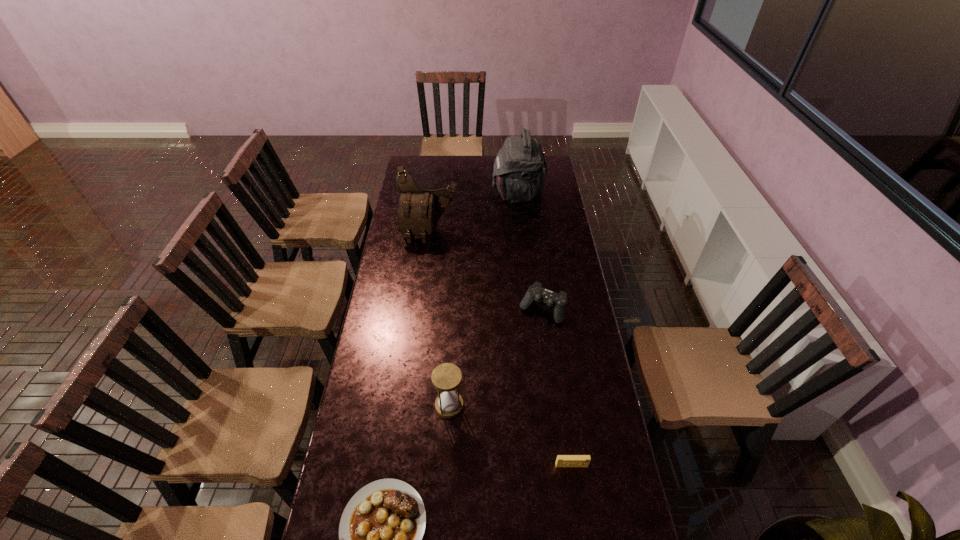
Find the location of a particular element. vacant position located 0.360m on the open flap of the right shoulder bag is located at coordinates (425, 193).

Where is `vacant space situated on the open flap of the right shoulder bag`? Image resolution: width=960 pixels, height=540 pixels. vacant space situated on the open flap of the right shoulder bag is located at coordinates (438, 193).

Identify the location of vacant space situated 0.190m on the open flap of the right shoulder bag. This screenshot has width=960, height=540. 457,193.

Identify the location of vacant area situated 0.150m on the front-facing side of the second farthest object. (425, 266).

You are a GUI agent. You are given a task and a screenshot of the screen. Output one action in this format:
    pyautogui.click(x=<x>, y=<y>)
    Task: Click on the vacant space situated 0.290m on the right of the hourglass
    
    Given the screenshot: What is the action you would take?
    pyautogui.click(x=549, y=406)

You are a GUI agent. You are given a task and a screenshot of the screen. Output one action in this format:
    pyautogui.click(x=<x>, y=<y>)
    Task: Click on the free region located on the front of the third farthest object
    Image resolution: width=960 pixels, height=540 pixels.
    Given the screenshot: What is the action you would take?
    pyautogui.click(x=548, y=355)

What are the coordinates of `vacant space located at the front of the second nearest object with spools` in the screenshot? It's located at (580, 523).

I want to click on object that is positioned at the far edge, so click(520, 168).

Find the location of a particular element. This screenshot has width=960, height=540. object that is at the left edge is located at coordinates (418, 212).

Locate an element on the screen. The image size is (960, 540). shoulder bag located at the right edge is located at coordinates (520, 168).